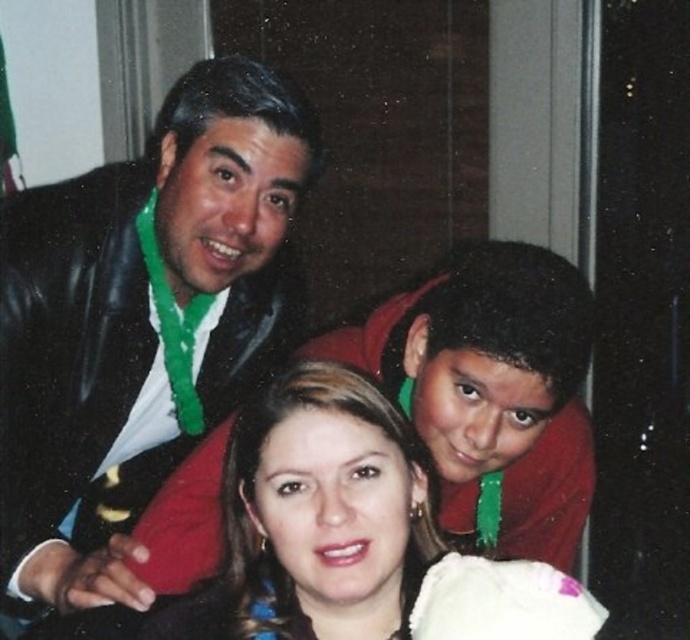
You are a photographer trying to adjust the lighting for a portrait. You notice the matte black jacket at upper left and the smooth skin face at center. Which object should you focus on to ensure proper exposure, considering their positions?

The smooth skin face at center should be focused on for proper exposure because the matte black jacket at upper left is above it, potentially causing the face to be in shadow if not prioritized.

You are a photographer adjusting the camera focus. The scene has a matte black jacket at upper left and a smooth skin face at center. Which object is wider in the image?

The matte black jacket at upper left is wider than the smooth skin face at center according to the description.